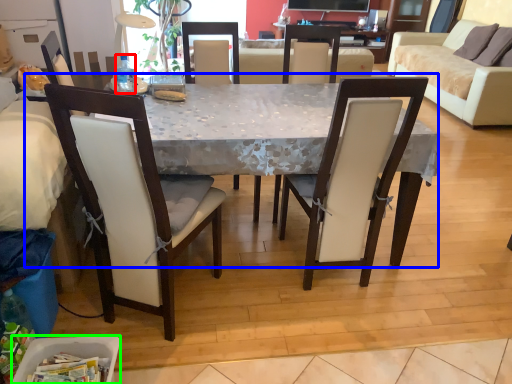
Question: Which object is the farthest from bottle (highlighted by a red box)? Choose among these: desk (highlighted by a blue box) or trash bin/can (highlighted by a green box).

Choices:
 (A) desk
 (B) trash bin/can

Answer: (B)